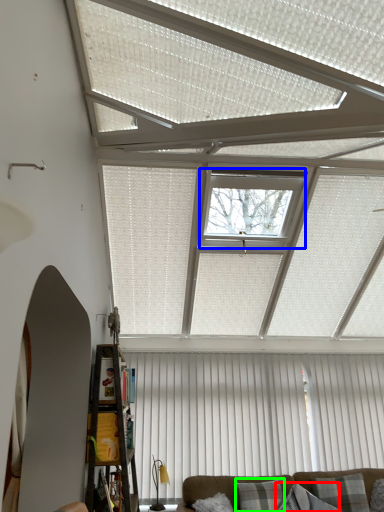
Question: Which object is the closest to the pillow (highlighted by a red box)? Choose among these: window (highlighted by a blue box) or pillow (highlighted by a green box).

Choices:
 (A) window
 (B) pillow

Answer: (B)